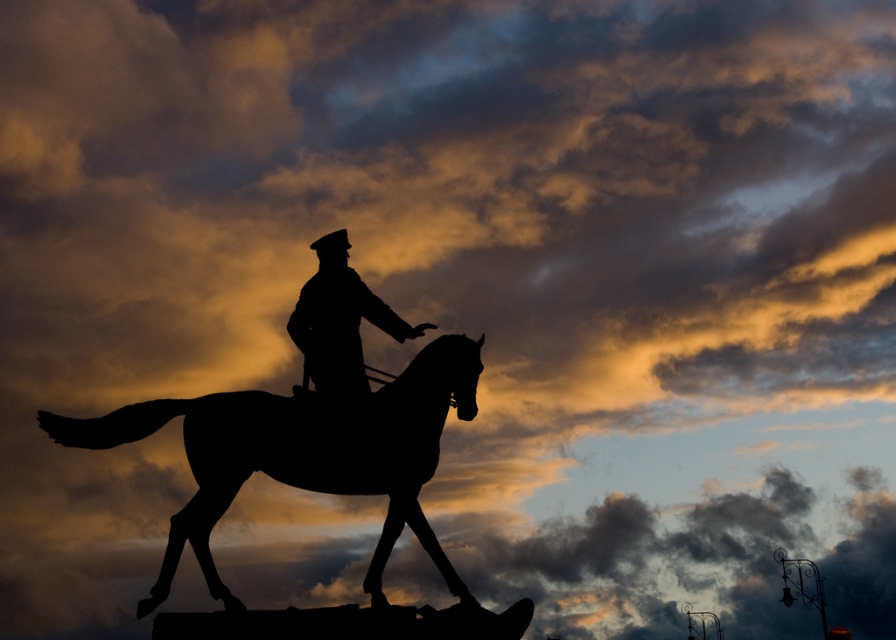
Question: In this image, where is silhouette horse at center located relative to silhouette uniform at center?

Choices:
 (A) left
 (B) right

Answer: (A)

Question: Is silhouette horse at center positioned at the back of silhouette uniform at center?

Choices:
 (A) yes
 (B) no

Answer: (B)

Question: From the image, what is the correct spatial relationship of silhouette horse at center in relation to silhouette uniform at center?

Choices:
 (A) above
 (B) below

Answer: (B)